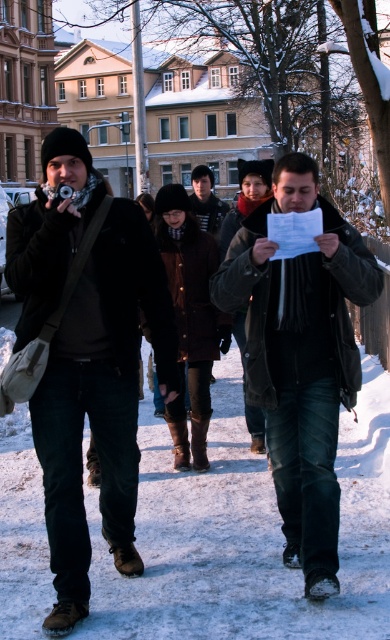
Question: Can you confirm if matte black jacket at left is positioned below dark gray leather jacket at center?

Choices:
 (A) yes
 (B) no

Answer: (B)

Question: Does white snow at lower center have a larger size compared to dark brown leather jacket at center?

Choices:
 (A) yes
 (B) no

Answer: (B)

Question: Which of these objects is positioned farthest from the dark gray leather jacket at center?

Choices:
 (A) white snow at lower center
 (B) dark brown leather jacket at center

Answer: (B)

Question: Which object is positioned farthest from the dark gray leather jacket at center?

Choices:
 (A) white snow at lower center
 (B) dark brown leather jacket at center

Answer: (B)

Question: Which of the following is the farthest from the observer?

Choices:
 (A) dark gray leather jacket at center
 (B) matte black jacket at left
 (C) dark brown leather jacket at center
 (D) white snow at lower center

Answer: (C)

Question: Does matte black jacket at left come behind dark gray leather jacket at center?

Choices:
 (A) no
 (B) yes

Answer: (A)